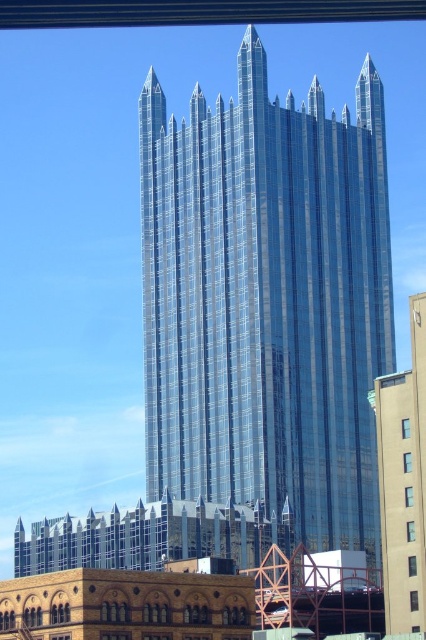
Question: Considering the relative positions of transparent glass tower at center and shiny glass skyscraper at center in the image provided, where is transparent glass tower at center located with respect to shiny glass skyscraper at center?

Choices:
 (A) above
 (B) below

Answer: (A)

Question: Does transparent glass tower at center have a greater width compared to shiny glass skyscraper at center?

Choices:
 (A) no
 (B) yes

Answer: (B)

Question: From the image, what is the correct spatial relationship of transparent glass tower at center in relation to shiny glass skyscraper at center?

Choices:
 (A) below
 (B) above

Answer: (B)

Question: Among these points, which one is farthest from the camera?

Choices:
 (A) (394, 420)
 (B) (193, 380)

Answer: (B)

Question: Which object is farther from the camera taking this photo?

Choices:
 (A) transparent glass tower at center
 (B) shiny glass skyscraper at center

Answer: (A)

Question: Which of the following is the farthest from the observer?

Choices:
 (A) (396, 593)
 (B) (273, 397)

Answer: (B)